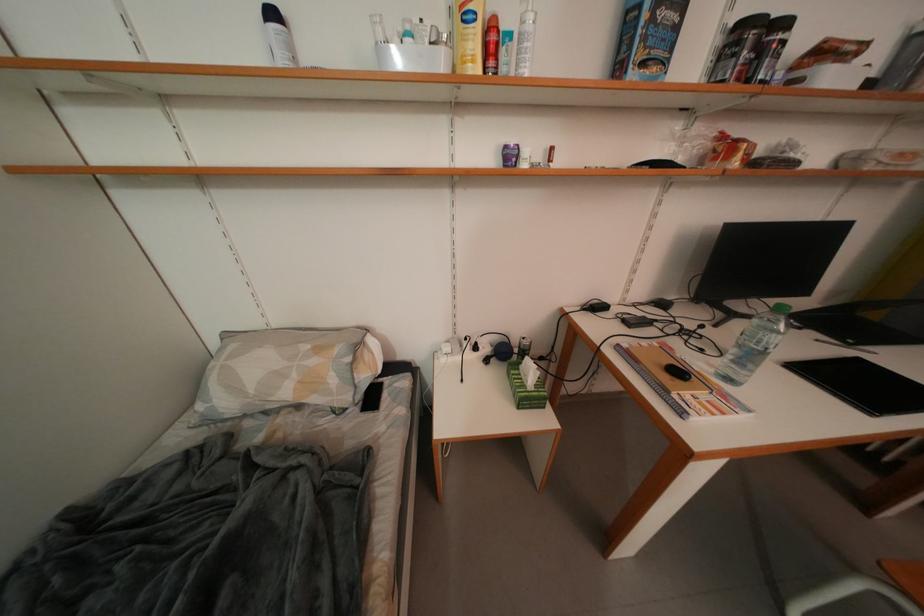
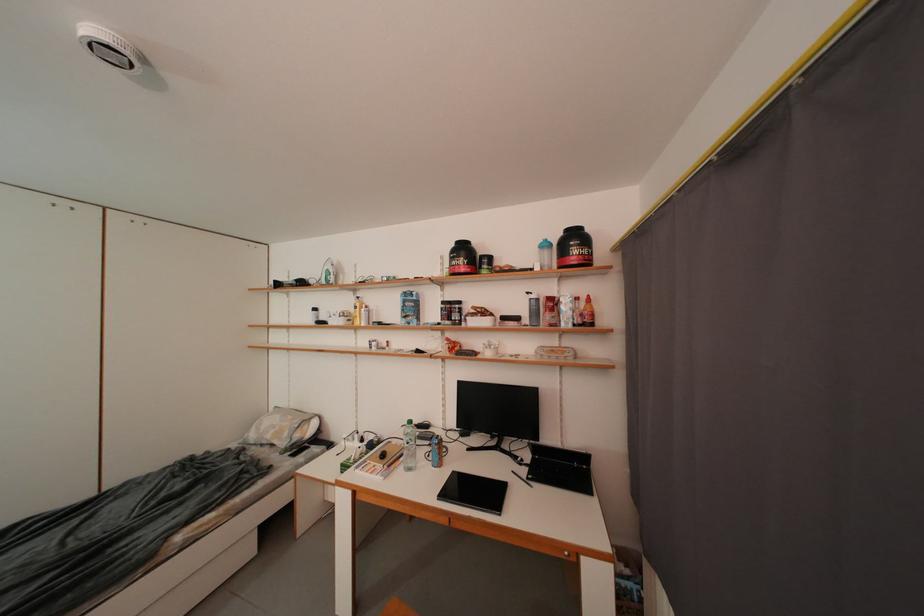
Find the pixel in the second image that matches (341,384) in the first image.

(294, 438)